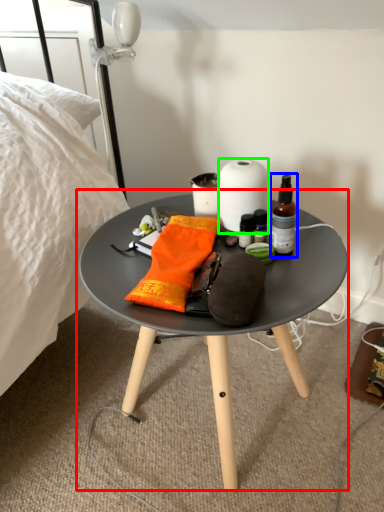
Question: Based on their relative distances, which object is nearer to coffee table (highlighted by a red box)? Choose from bottle (highlighted by a blue box) and paper towel (highlighted by a green box).

Choices:
 (A) bottle
 (B) paper towel

Answer: (A)